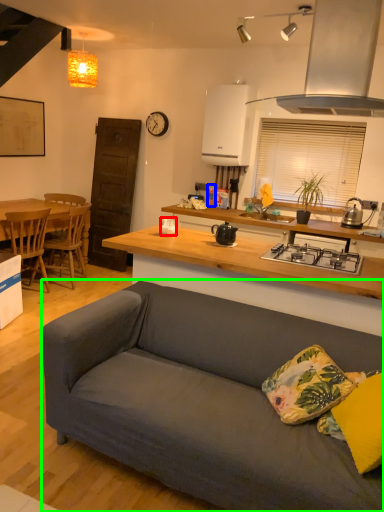
Question: Estimate the real-world distances between objects in this image. Which object is farther from coffee cup (highlighted by a red box), bottle (highlighted by a blue box) or studio couch (highlighted by a green box)?

Choices:
 (A) bottle
 (B) studio couch

Answer: (A)